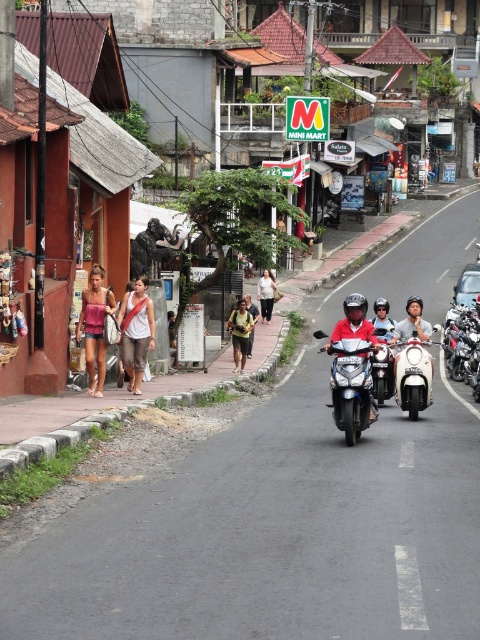
You are a pedestrian standing on the sidewalk and want to cross the street. There is a shiny silver motorcycle at center and a white glossy scooter at center moving towards you. Which vehicle will reach you first?

The shiny silver motorcycle at center is closer to the viewer than the white glossy scooter at center, so the shiny silver motorcycle at center will reach you first.

You are a delivery person who needs to carry both the yellow fabric bag at center and the white cotton shirt at center. Which item is wider and can fit more items?

The yellow fabric bag at center is wider than the white cotton shirt at center, so it can fit more items.